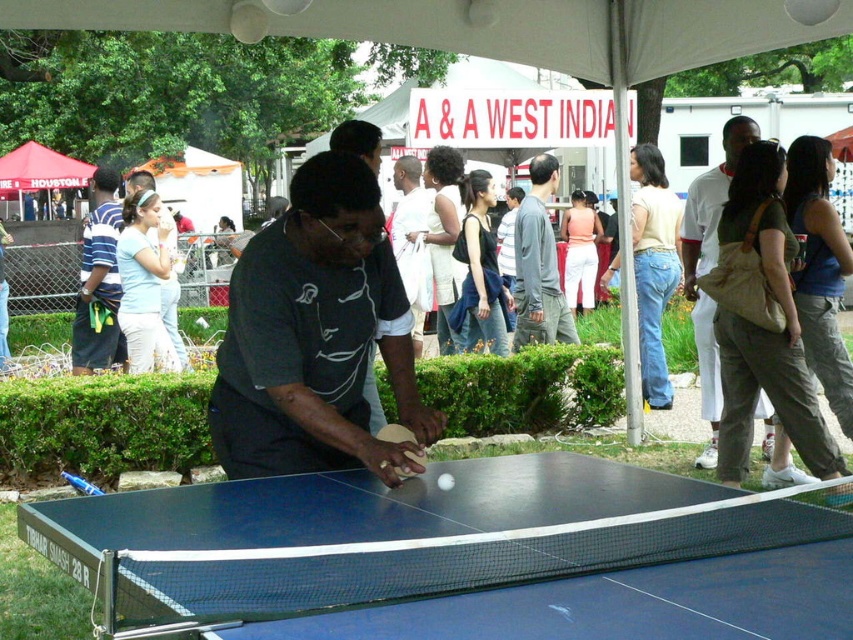
You are a photographer at the event and want to capture a photo that includes both the white cotton shirt at right and the blue rubber table tennis racket at lower left. Which object should you focus on first if you want to ensure both are in the frame?

The white cotton shirt at right is taller than the blue rubber table tennis racket at lower left, so you should focus on the white cotton shirt at right first to ensure both are in the frame.

You are standing at the center of the ping pong table and want to greet the person wearing the white cotton shirt at right. In which direction should you walk to reach them?

The white cotton shirt at right is located at point 0.412 on the x and 0.832 on the y, so you should walk towards the right side of the image to reach them.